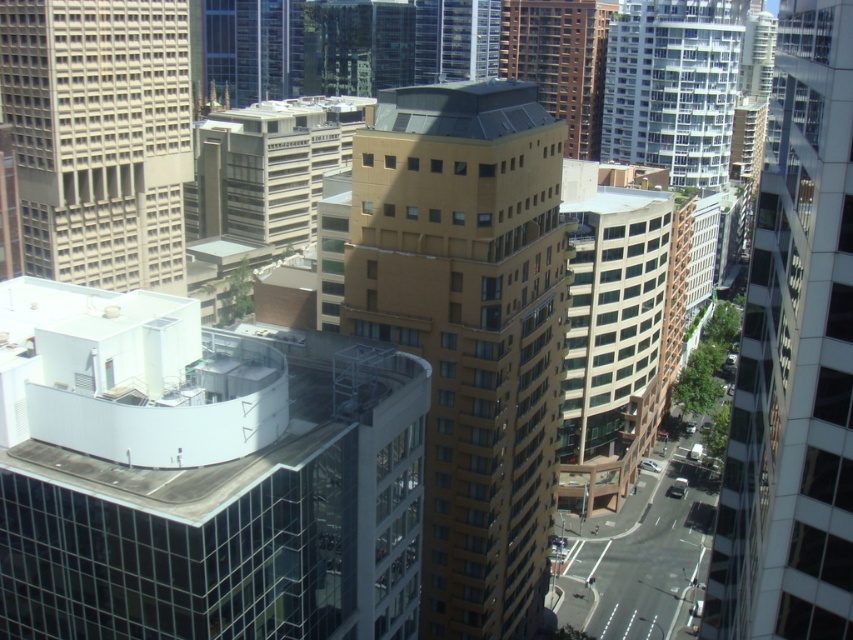
Question: Among these points, which one is nearest to the camera?

Choices:
 (A) tap(698, 3)
 (B) tap(59, 42)
 (C) tap(809, 564)

Answer: (C)

Question: Can you confirm if matte gold building at center is wider than brown glassy building at center?

Choices:
 (A) yes
 (B) no

Answer: (B)

Question: Is white glass building at upper right bigger than brown glassy building at center?

Choices:
 (A) no
 (B) yes

Answer: (A)

Question: Which is farther from the white glass building at upper right?

Choices:
 (A) matte gold building at center
 (B) brown glass building at center
 (C) matte gray building at center

Answer: (B)

Question: Can you confirm if matte gray building at center is bigger than white glass building at upper right?

Choices:
 (A) no
 (B) yes

Answer: (A)

Question: Which point is farther from the camera taking this photo?

Choices:
 (A) coord(665,72)
 (B) coord(524,42)

Answer: (B)